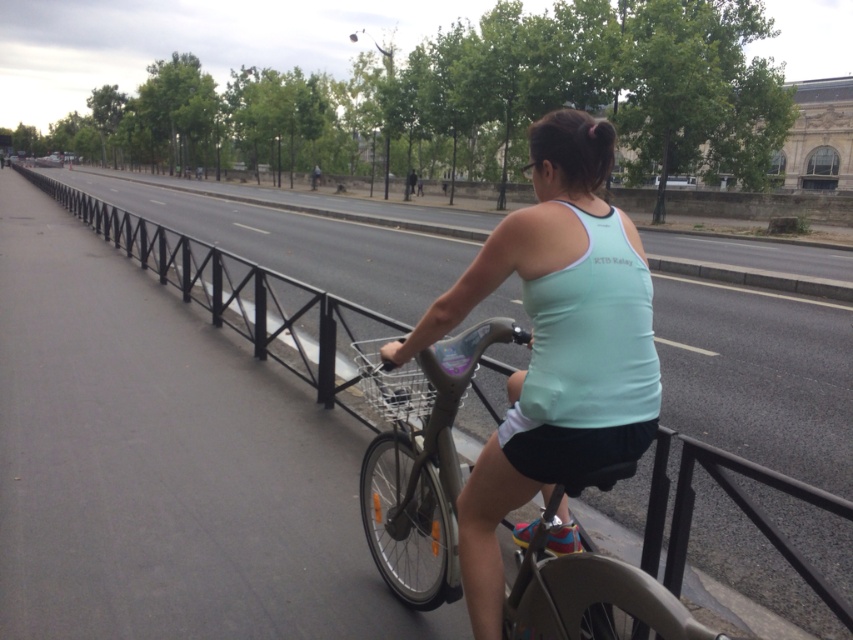
Does light blue fabric tank top at center have a smaller size compared to black metal rail at center?

Yes, light blue fabric tank top at center is smaller than black metal rail at center.

At what (x,y) coordinates should I click in order to perform the action: click on light blue fabric tank top at center. Please return your answer as a coordinate pair (x, y). The image size is (853, 640). Looking at the image, I should click on (554, 346).